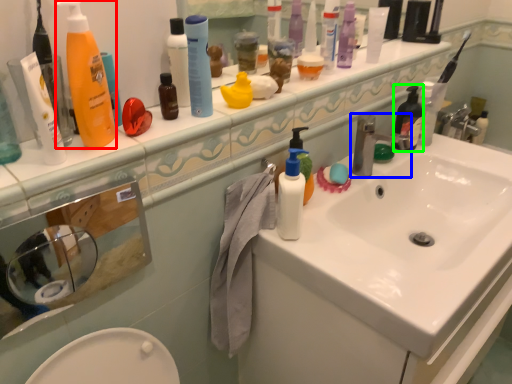
Question: Which object is positioned closest to cleaning product (highlighted by a red box)? Select from tap (highlighted by a blue box) and toiletry (highlighted by a green box).

Choices:
 (A) tap
 (B) toiletry

Answer: (A)